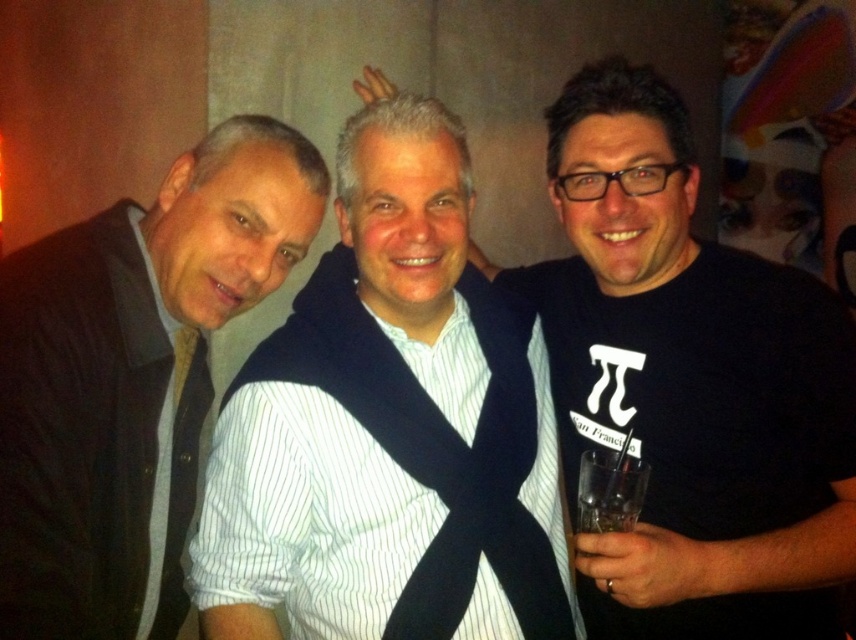
Does white striped shirt at center have a lesser height compared to black matte t-shirt at right?

Correct, white striped shirt at center is not as tall as black matte t-shirt at right.

Who is more forward, (284, 545) or (717, 460)?

Point (284, 545) is more forward.

This screenshot has width=856, height=640. What are the coordinates of `white striped shirt at center` in the screenshot? It's located at (390, 428).

In order to click on white striped shirt at center in this screenshot , I will do `click(390, 428)`.

Does white striped shirt at center have a larger size compared to matte black jacket at left?

Incorrect, white striped shirt at center is not larger than matte black jacket at left.

Which is more to the right, white striped shirt at center or matte black jacket at left?

Positioned to the right is white striped shirt at center.

Is point (376, 241) in front of point (223, 131)?

Yes, point (376, 241) is closer to viewer.

The image size is (856, 640). What are the coordinates of `white striped shirt at center` in the screenshot? It's located at (390, 428).

Can you confirm if black matte t-shirt at right is positioned to the right of matte black jacket at left?

Yes, black matte t-shirt at right is to the right of matte black jacket at left.

Does point (670, 112) lie in front of point (39, 417)?

No.

Identify the location of black matte t-shirt at right. The height and width of the screenshot is (640, 856). (688, 384).